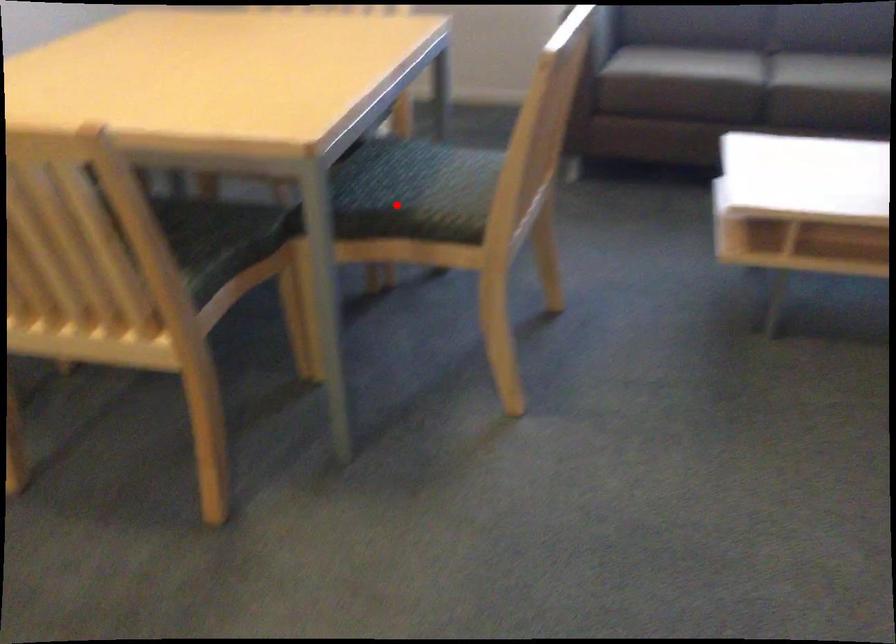
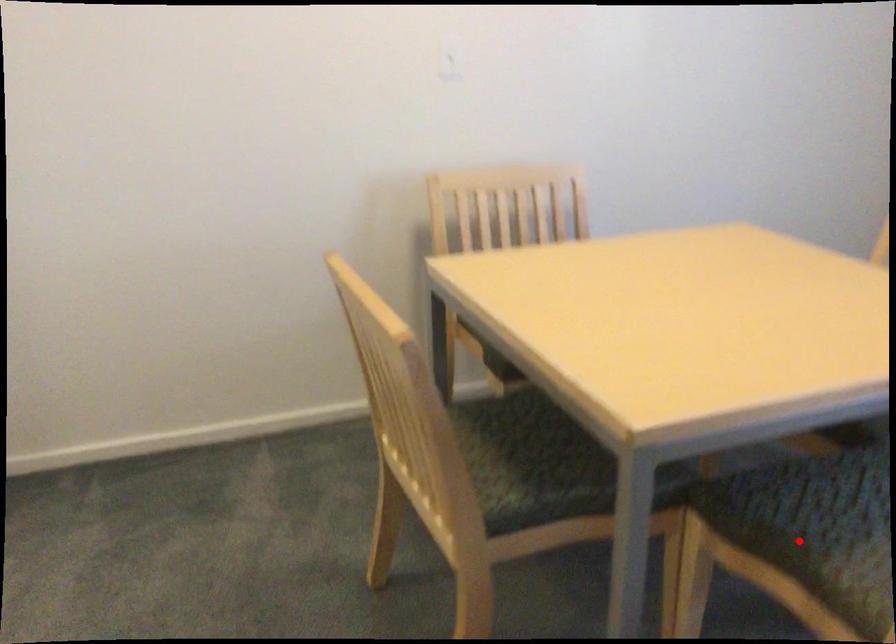
In the scene shown: I am providing you with two images of the same scene from different viewpoints. A red point is marked on the first image and another point is marked on the second image. Are the points marked in image1 and image2 representing the same 3D position?

Yes